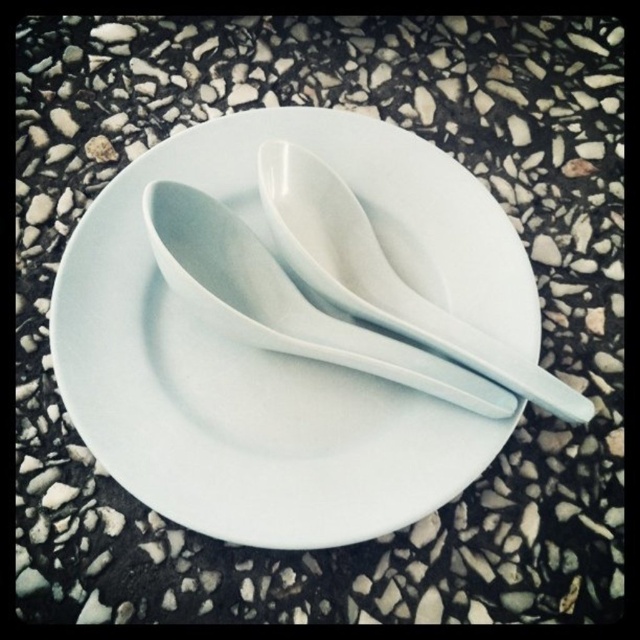
Between white ceramic saucer at center and white glossy spoon at center, which one is positioned higher?

white glossy spoon at center is higher up.

Which is below, white ceramic saucer at center or white glossy spoon at center?

Positioned lower is white ceramic saucer at center.

Between point (448, 413) and point (481, 352), which one is positioned in front?

Point (481, 352)

The width and height of the screenshot is (640, 640). In order to click on white ceramic saucer at center in this screenshot , I will do `click(280, 355)`.